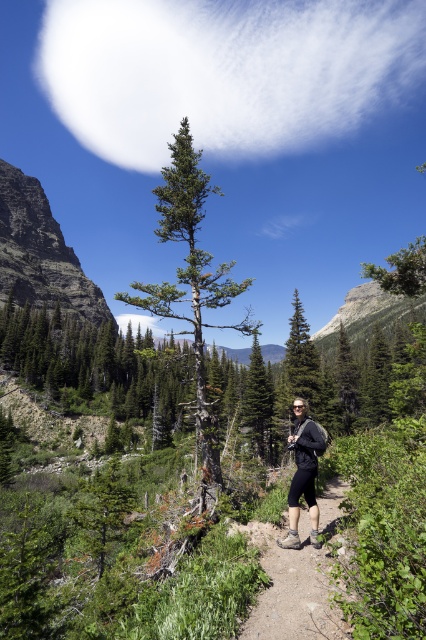
Question: Is rugged rock cliff at left smaller than brown dirt trail at center?

Choices:
 (A) yes
 (B) no

Answer: (B)

Question: Does white fluffy cloud at upper center appear under green rough bark tree at upper right?

Choices:
 (A) yes
 (B) no

Answer: (B)

Question: Which of the following is the closest to the observer?

Choices:
 (A) click(x=51, y=276)
 (B) click(x=187, y=221)
 (C) click(x=396, y=273)

Answer: (C)

Question: Which of the following is the closest to the observer?

Choices:
 (A) (264, 449)
 (B) (32, 248)

Answer: (A)

Question: Does rugged rock cliff at left lie behind green rough bark tree at upper right?

Choices:
 (A) yes
 (B) no

Answer: (A)

Question: Based on their relative distances, which object is farther from the matte black hiking boots at center?

Choices:
 (A) green rough bark tree at upper right
 (B) brown dirt trail at center

Answer: (A)